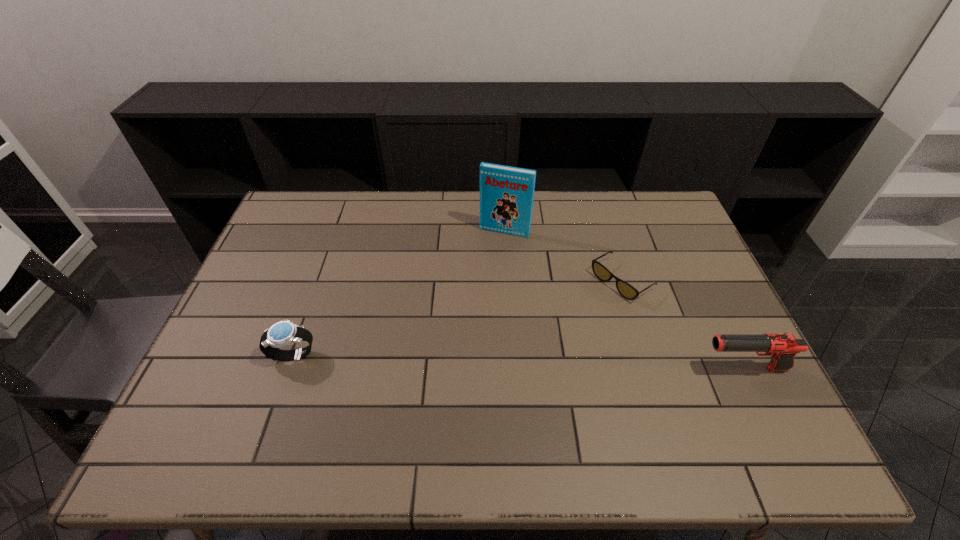
Where is `free space that satisfies the following two spatial constraints: 1. on the front side of the third object from left to right; 2. on the right side of the farthest object`? This screenshot has width=960, height=540. free space that satisfies the following two spatial constraints: 1. on the front side of the third object from left to right; 2. on the right side of the farthest object is located at coordinates (508, 281).

Image resolution: width=960 pixels, height=540 pixels. I want to click on vacant position in the image that satisfies the following two spatial constraints: 1. on the front side of the watch; 2. at the aiming end of the gun, so click(x=289, y=369).

Where is `vacant point that satisfies the following two spatial constraints: 1. on the front side of the watch; 2. at the aiming end of the gun`? The width and height of the screenshot is (960, 540). vacant point that satisfies the following two spatial constraints: 1. on the front side of the watch; 2. at the aiming end of the gun is located at coordinates (289, 369).